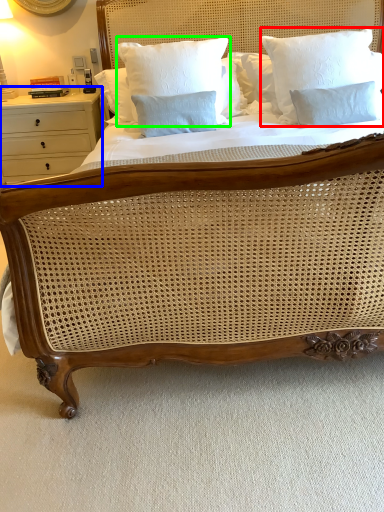
Question: Based on their relative distances, which object is nearer to pillow (highlighted by a red box)? Choose from nightstand (highlighted by a blue box) and pillow (highlighted by a green box).

Choices:
 (A) nightstand
 (B) pillow

Answer: (B)